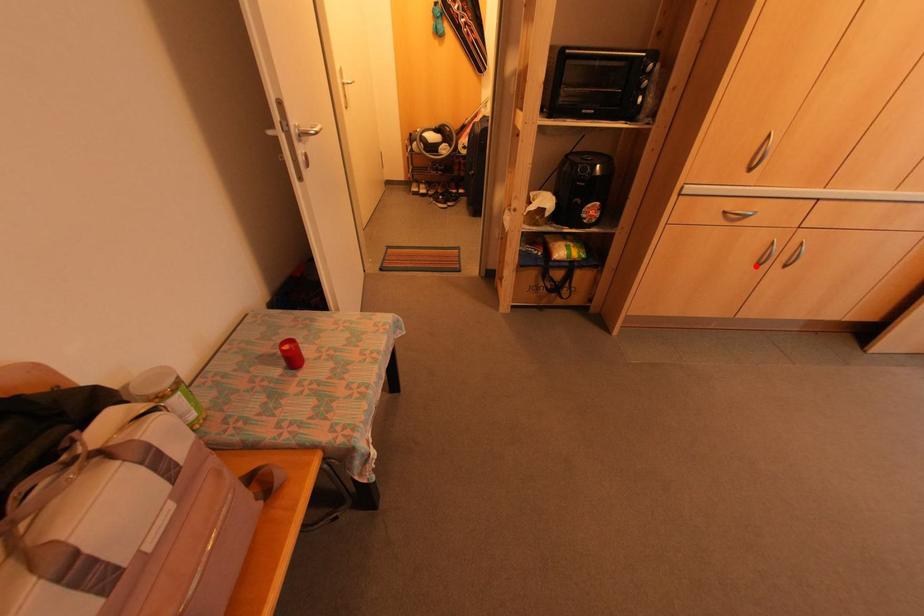
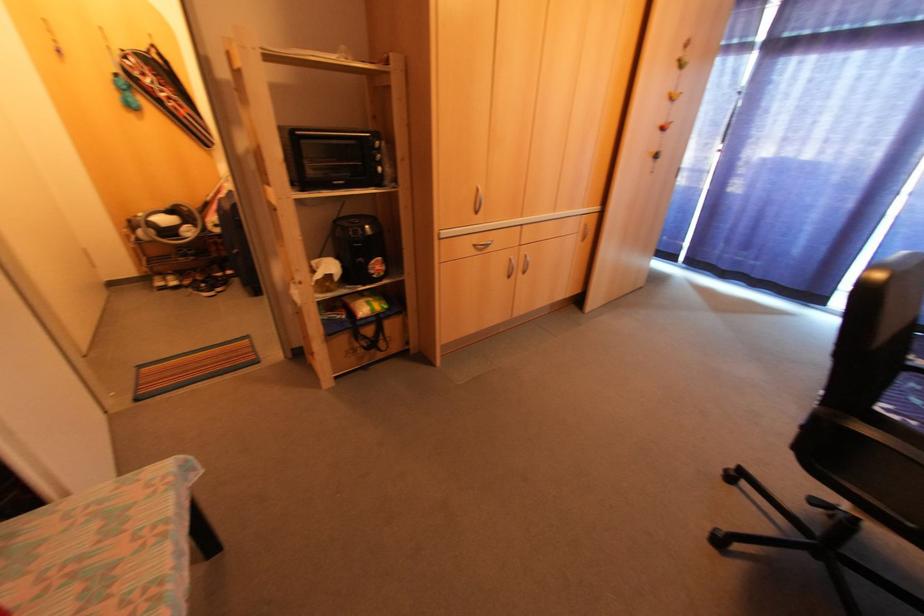
The point at the highlighted location is marked in the first image. Where is the corresponding point in the second image?

(506, 277)